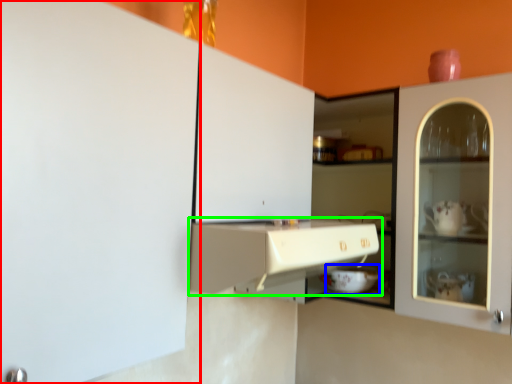
Question: Which object is the closest to the cabinetry (highlighted by a red box)? Choose among these: appliance (highlighted by a blue box) or cabinetry (highlighted by a green box).

Choices:
 (A) appliance
 (B) cabinetry

Answer: (B)